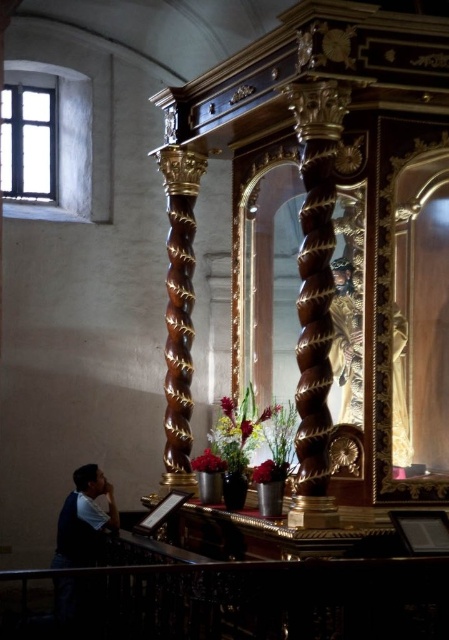
You are standing at the entrance of the church and want to place a small bouquet of flowers on the glossy metal balustrade at lower center. However, you notice another bouquet already placed on the glossy wood column at center. Considering the height of both objects, which surface will allow the bouquet to be more visible to people entering the church?

The glossy wood column at center is taller than the glossy metal balustrade at lower center, so placing the bouquet on the glossy wood column at center will make it more visible to people entering the church.

You are a visitor standing in the church and want to place a small bouquet of flowers between the glossy metal balustrade at lower center and the glossy wood column at center. Can the bouquet fit between them?

The glossy metal balustrade at lower center is wider than the glossy wood column at center, so the bouquet may not fit between them as the balustrade is wider.